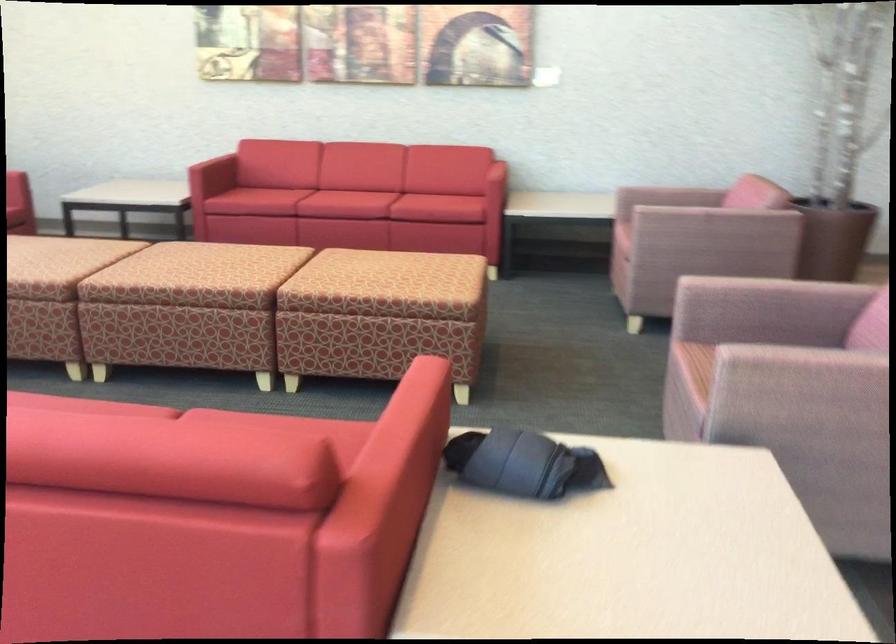
Locate an element on the screen. This screenshot has height=644, width=896. rolled up clothing is located at coordinates (522, 464).